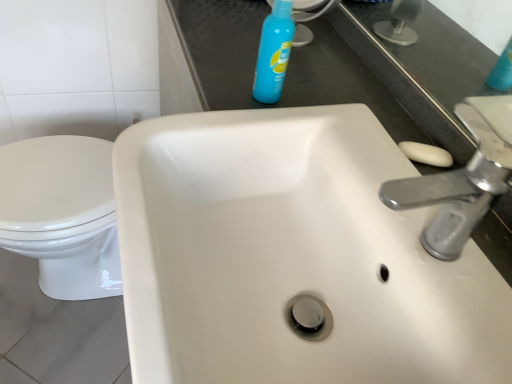
Question: Relative to white ceramic sink at center, is silver metallic faucet at upper right in front or behind?

Choices:
 (A) behind
 (B) front

Answer: (A)

Question: From the image's perspective, is silver metallic faucet at upper right above or below white ceramic sink at center?

Choices:
 (A) above
 (B) below

Answer: (A)

Question: Estimate the real-world distances between objects in this image. Which object is closer to the blue plastic spray bottle at upper center?

Choices:
 (A) white glossy toilet at lower left
 (B) white ceramic sink at center
 (C) silver metallic faucet at upper right

Answer: (B)

Question: Considering the real-world distances, which object is closest to the white ceramic sink at center?

Choices:
 (A) white glossy toilet at lower left
 (B) blue plastic spray bottle at upper center
 (C) silver metallic faucet at upper right

Answer: (C)